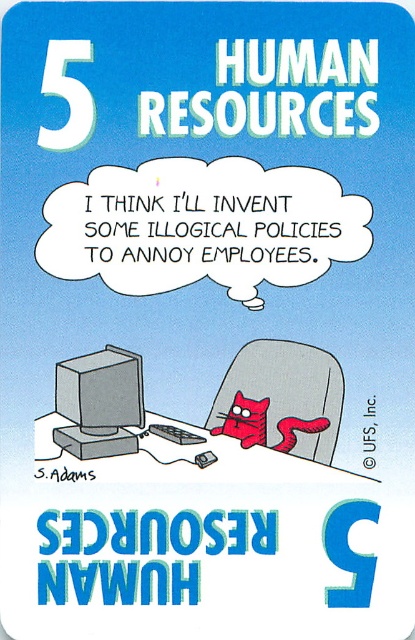
In the scene shown: Does gray fabric chair at center have a greater width compared to matte gray monitor at center?

Indeed, gray fabric chair at center has a greater width compared to matte gray monitor at center.

Is gray fabric chair at center above matte gray monitor at center?

No, gray fabric chair at center is not above matte gray monitor at center.

Who is more distant from viewer, [314,376] or [73,440]?

Point [314,376]

I want to click on gray fabric chair at center, so click(280, 397).